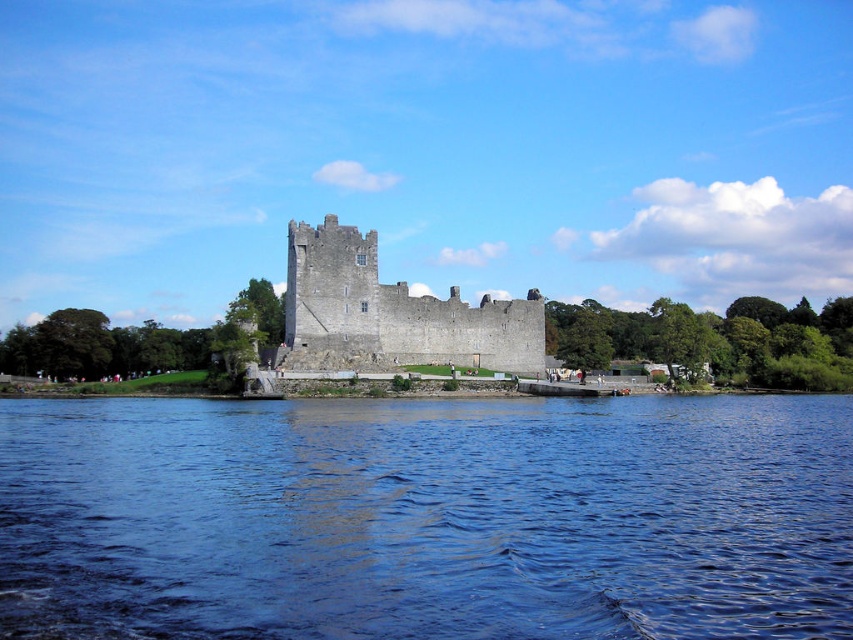
Question: Among these points, which one is farthest from the camera?

Choices:
 (A) (338, 348)
 (B) (653, 573)

Answer: (A)

Question: Is blue water at lower center above gray stone castle at center?

Choices:
 (A) no
 (B) yes

Answer: (A)

Question: Is blue water at lower center closer to the viewer compared to gray stone castle at center?

Choices:
 (A) no
 (B) yes

Answer: (B)

Question: Considering the relative positions of blue water at lower center and gray stone castle at center in the image provided, where is blue water at lower center located with respect to gray stone castle at center?

Choices:
 (A) right
 (B) left

Answer: (A)